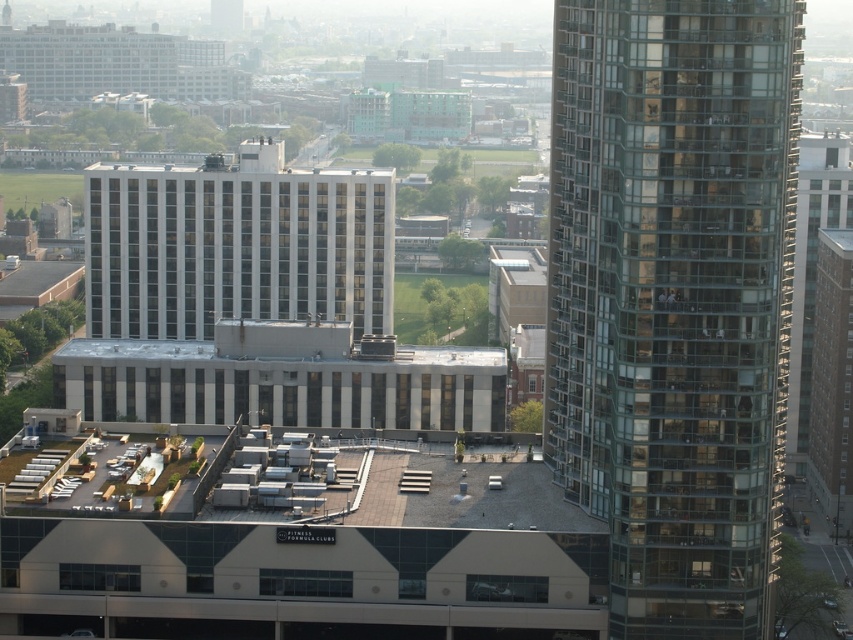
You are a city planner analyzing the urban layout. You need to determine which building occupies more horizontal space in the frame. Based on the image, which building has a greater width between the transparent glass building at right and the white matte building at center?

The white matte building at center has a greater width than the transparent glass building at right.

You are a city planner evaluating the skyline. You need to determine which building, the transparent glass building at right or the white matte building at center, has a greater height. Based on the given information, which one is taller?

The white matte building at center is taller than the transparent glass building at right.